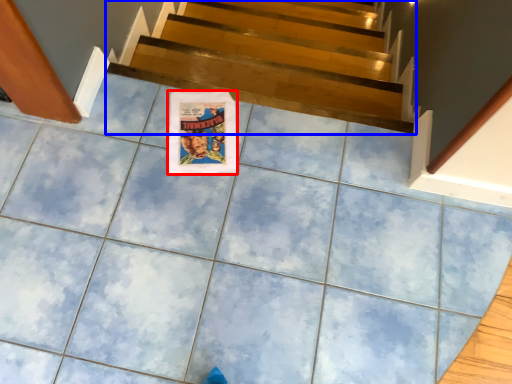
Question: Which object is closer to the camera taking this photo, poster page (highlighted by a red box) or stairs (highlighted by a blue box)?

Choices:
 (A) poster page
 (B) stairs

Answer: (A)